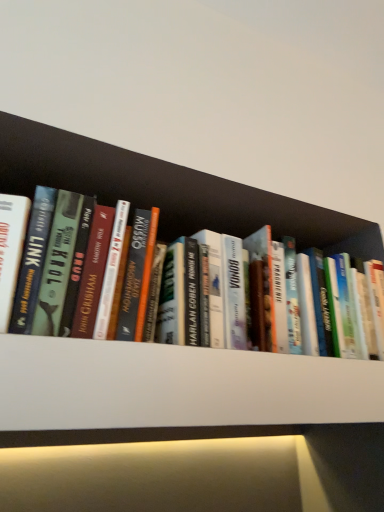
Locate an element on the screen. Image resolution: width=384 pixels, height=512 pixels. hardcover book at center is located at coordinates (61, 265).

What do you see at coordinates (61, 265) in the screenshot? I see `hardcover book at center` at bounding box center [61, 265].

Measure the distance between point (49, 246) and camera.

Point (49, 246) is 21.85 inches from camera.

Identify the location of white matte shelf at center. (172, 391).

The image size is (384, 512). What do you see at coordinates (172, 391) in the screenshot?
I see `white matte shelf at center` at bounding box center [172, 391].

What are the coordinates of `hardcover book at center` in the screenshot? It's located at (61, 265).

Considering the positions of objects hardcover book at center and white matte shelf at center in the image provided, who is more to the right, hardcover book at center or white matte shelf at center?

hardcover book at center is more to the right.

Relative to white matte shelf at center, is hardcover book at center in front or behind?

Clearly, hardcover book at center is behind white matte shelf at center.

Between point (47, 234) and point (180, 401), which one is positioned in front?

The point (180, 401) is in front.

From the image's perspective, which is below, hardcover book at center or white matte shelf at center?

white matte shelf at center is shown below in the image.

From a real-world perspective, is hardcover book at center on white matte shelf at center?

Yes, from a real-world perspective, hardcover book at center is over white matte shelf at center

Is hardcover book at center thinner than white matte shelf at center?

Yes, hardcover book at center is thinner than white matte shelf at center.

Considering the sizes of objects hardcover book at center and white matte shelf at center in the image provided, who is shorter, hardcover book at center or white matte shelf at center?

With less height is white matte shelf at center.

Looking at the image, does hardcover book at center seem bigger or smaller compared to white matte shelf at center?

Clearly, hardcover book at center is larger in size than white matte shelf at center.

Is hardcover book at center situated inside white matte shelf at center or outside?

hardcover book at center lies outside white matte shelf at center.

Would you say hardcover book at center is a long distance from white matte shelf at center?

No, hardcover book at center is not far from white matte shelf at center.

Is hardcover book at center facing away from white matte shelf at center?

No, hardcover book at center is not facing away from white matte shelf at center.

How much distance is there between hardcover book at center and white matte shelf at center?

3.89 inches.

This screenshot has height=512, width=384. I want to click on shelf below the hardcover book at center (from a real-world perspective), so click(172, 391).

Between white matte shelf at center and hardcover book at center, which one appears on the left side from the viewer's perspective?

Positioned to the left is white matte shelf at center.

Between white matte shelf at center and hardcover book at center, which one is positioned in front?

white matte shelf at center is more forward.

Between point (251, 400) and point (94, 292), which one is positioned behind?

The point (251, 400) is farther from the camera.

From the image's perspective, is white matte shelf at center located beneath hardcover book at center?

Yes, from the image's perspective, white matte shelf at center is below hardcover book at center.

From a real-world perspective, is white matte shelf at center physically above hardcover book at center?

Incorrect, from a real-world perspective, white matte shelf at center is lower than hardcover book at center.

Looking at their sizes, would you say white matte shelf at center is wider or thinner than hardcover book at center?

white matte shelf at center is wider than hardcover book at center.

In terms of height, does white matte shelf at center look taller or shorter compared to hardcover book at center?

In the image, white matte shelf at center appears to be shorter than hardcover book at center.

Considering the sizes of white matte shelf at center and hardcover book at center in the image, is white matte shelf at center bigger or smaller than hardcover book at center?

Considering their sizes, white matte shelf at center takes up less space than hardcover book at center.

Would you say white matte shelf at center contains hardcover book at center?

No, hardcover book at center is located outside of white matte shelf at center.

Consider the image. Is white matte shelf at center positioned far away from hardcover book at center?

No, white matte shelf at center is not far from hardcover book at center.

Is white matte shelf at center oriented away from hardcover book at center?

No, white matte shelf at center's orientation is not away from hardcover book at center.

How different are the orientations of white matte shelf at center and hardcover book at center in degrees?

The angle between the facing direction of white matte shelf at center and the facing direction of hardcover book at center is 0.000741 degrees.

How much distance is there between white matte shelf at center and hardcover book at center?

white matte shelf at center is 3.89 inches from hardcover book at center.

You are a GUI agent. You are given a task and a screenshot of the screen. Output one action in this format:
    pyautogui.click(x=<x>, y=<y>)
    Task: Click on the shelf beneath the hardcover book at center (from a real-world perspective)
    This screenshot has height=512, width=384.
    Given the screenshot: What is the action you would take?
    pyautogui.click(x=172, y=391)

In the image, there is a hardcover book at center. Identify the location of shelf below it (from a real-world perspective). Image resolution: width=384 pixels, height=512 pixels. (172, 391).

Where is `shelf below the hardcover book at center (from the image's perspective)`? Image resolution: width=384 pixels, height=512 pixels. shelf below the hardcover book at center (from the image's perspective) is located at coordinates (172, 391).